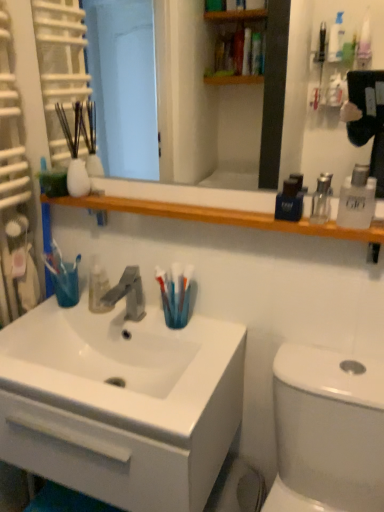
Question: Looking at their shapes, would you say clear glass mouthwash at upper right, placed as the 2th mouthwash when sorted from left to right, is wider or thinner than satin nickel faucet at center?

Choices:
 (A) wide
 (B) thin

Answer: (B)

Question: Looking at the image, does clear glass mouthwash at upper right, placed as the 2th mouthwash when sorted from left to right, seem bigger or smaller compared to satin nickel faucet at center?

Choices:
 (A) big
 (B) small

Answer: (B)

Question: Estimate the real-world distances between objects in this image. Which object is farther from the blue plastic toothbrush at sink?

Choices:
 (A) satin nickel faucet at center
 (B) white glossy toilet at lower right
 (C) clear plastic bottle at right, marked as the first mouthwash in a right-to-left arrangement
 (D) clear glass mouthwash at upper right, placed as the 2th mouthwash when sorted from left to right
 (E) blue glossy mouthwash at upper right, the 1th mouthwash positioned from the left

Answer: (C)

Question: Considering the real-world distances, which object is farthest from the white glossy toilet at lower right?

Choices:
 (A) clear plastic bottle at right, marked as the third mouthwash in a left-to-right arrangement
 (B) wooden shelf at upper center
 (C) white glossy cabinet at lower left
 (D) clear glass mouthwash at upper right, the second mouthwash positioned from the right
 (E) satin nickel faucet at center

Answer: (B)